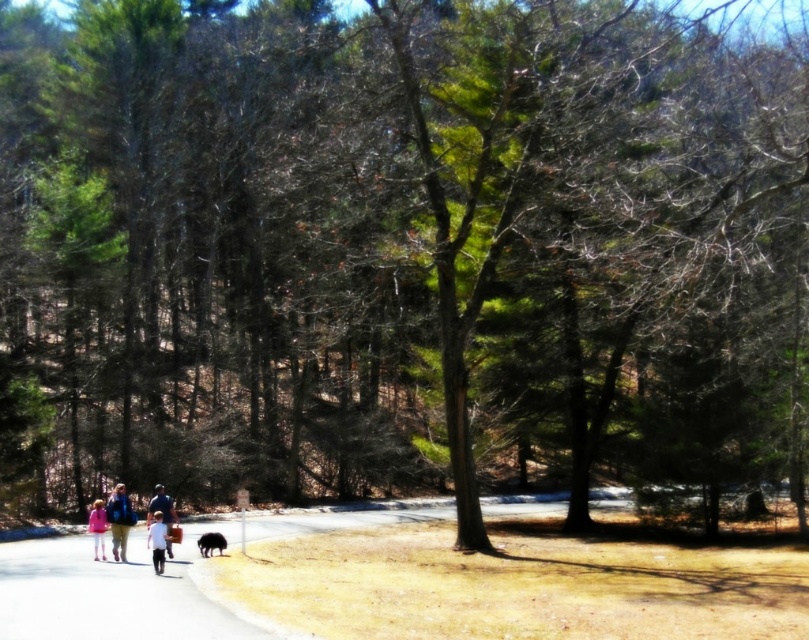
You are a photographer standing on the paved pathway in the park scene. You notice the white cotton shirt at center and the pink fabric at lower left in your viewfinder. Which object is located higher in the frame?

The white cotton shirt at center is positioned over the pink fabric at lower left, meaning it is higher in the frame.

You are a photographer trying to capture a group photo of the two adults and two children walking on the pathway. You notice both the white cotton shirt at center and the white matte shirt at center. Which shirt will appear brighter in the photo due to its material reflecting more light?

The white cotton shirt at center will appear brighter in the photo because cotton typically reflects more light than matte materials, making it stand out more against the darker surroundings.